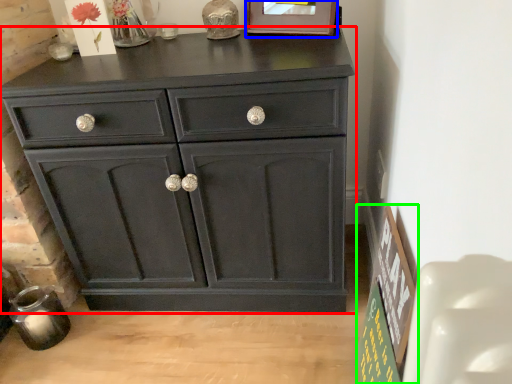
Question: Which object is the closest to the chest of drawers (highlighted by a red box)? Choose among these: picture frame (highlighted by a blue box) or bulletin board (highlighted by a green box).

Choices:
 (A) picture frame
 (B) bulletin board

Answer: (B)